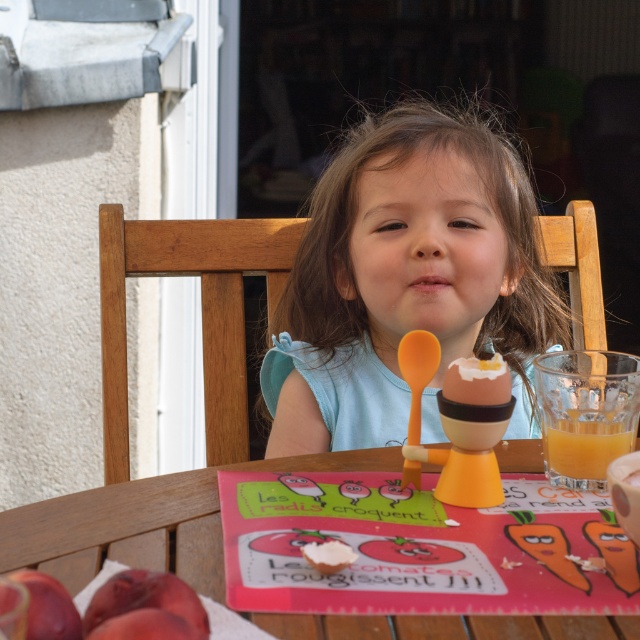
You are a parent preparing lunch for your child. You have a wooden table at center and a translucent glass cup at right. Which object would you place the juice in?

The translucent glass cup at right is the appropriate container for the juice, as it is a cup designed to hold liquids, while the wooden table at center is a larger surface for placing items but not meant for holding drinks.

Where is the matte blue shirt at center located in the image?

The matte blue shirt at center is located at point coordinates of (404, 278).

You are a delivery drone carrying a small package. You need to land at point (x=424, y=138). The minimum safe landing distance required for your drone is 40 inches. Can you safely land at that point?

The distance between the drone and point (x=424, y=138) is 35.20 inches, which is less than the required 40 inches minimum safe landing distance. Therefore, the drone cannot safely land at that point.